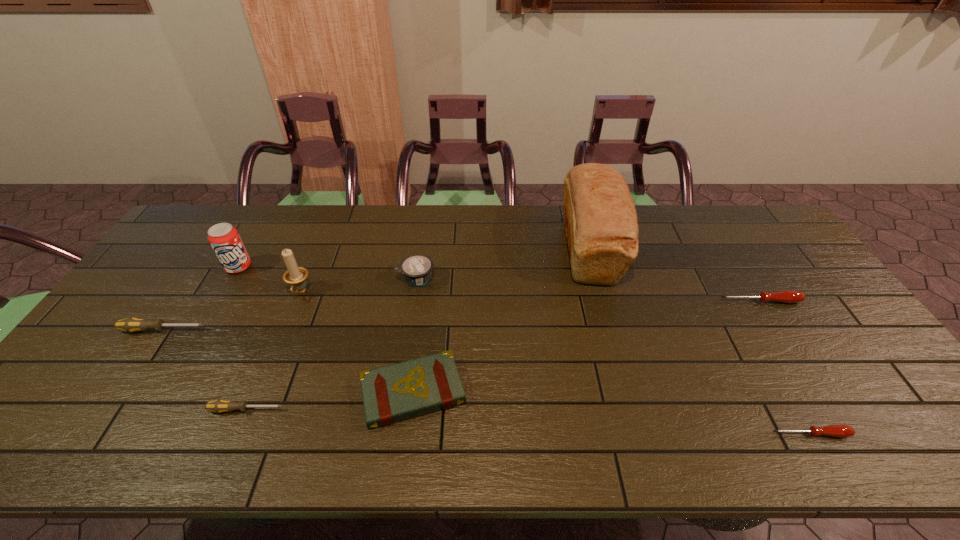
Locate an element on the screen. The height and width of the screenshot is (540, 960). the second nearest screwdriver is located at coordinates (218, 406).

What are the coordinates of `the nearer gray screwdriver` in the screenshot? It's located at (218, 406).

Image resolution: width=960 pixels, height=540 pixels. Find the location of `the nearer red screwdriver`. the nearer red screwdriver is located at coordinates (842, 431).

Locate an element on the screen. This screenshot has height=540, width=960. the shortest object is located at coordinates (842, 431).

Where is `blank space located 0.080m on the left of the brown bread`? The height and width of the screenshot is (540, 960). blank space located 0.080m on the left of the brown bread is located at coordinates (536, 249).

Locate an element on the screen. The image size is (960, 540). vacant space located on the handle side of the candle_holder is located at coordinates (262, 387).

The height and width of the screenshot is (540, 960). Identify the location of vacant space located on the surface of the soda can. (187, 355).

Identify the location of free space located 0.100m on the back of the yogurt. (420, 247).

I want to click on vacant space located 0.050m at the tip of the sixth farthest object, so (226, 330).

At what (x,y) coordinates should I click in order to perform the action: click on vacant space situated 0.220m on the back of the farthest screwdriver. Please return your answer as a coordinate pair (x, y). The width and height of the screenshot is (960, 540). Looking at the image, I should click on (727, 248).